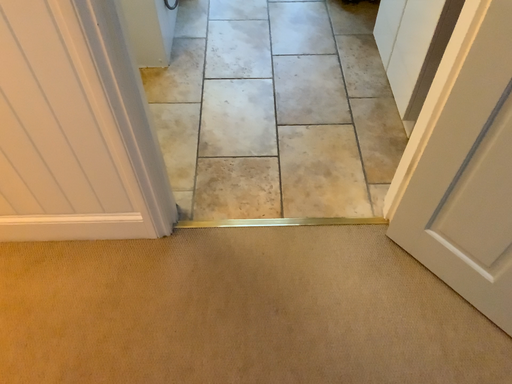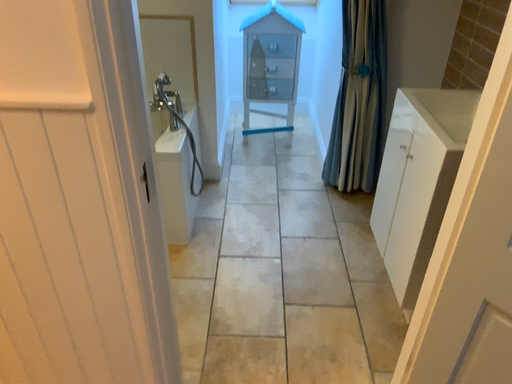
Question: How did the camera likely rotate when shooting the video?

Choices:
 (A) rotated upward
 (B) rotated downward

Answer: (A)